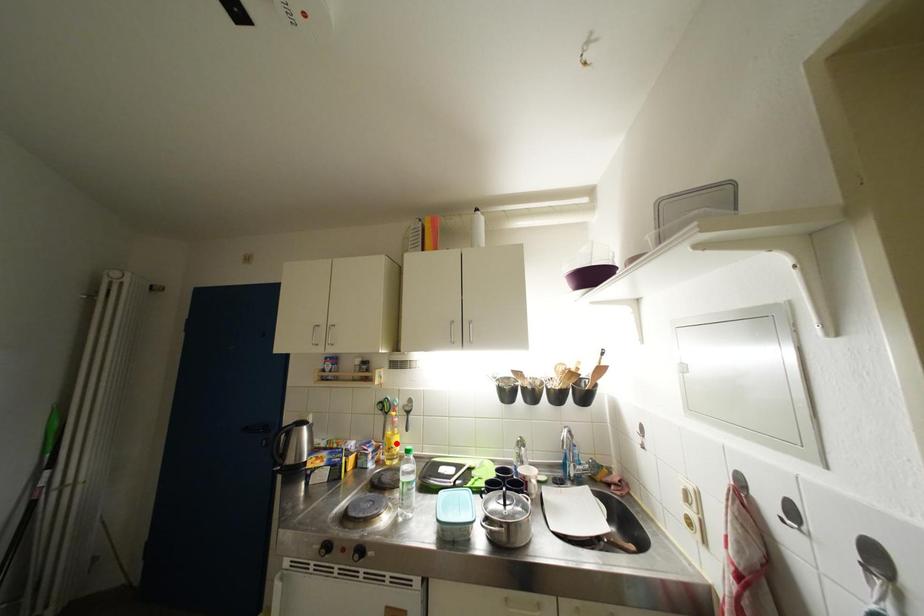
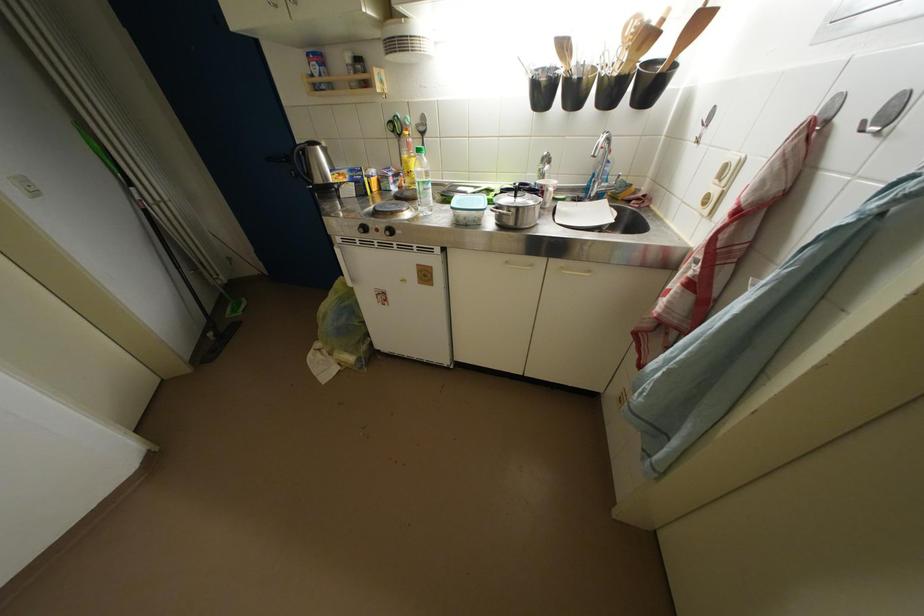
In the second image, find the point that corresponds to the highlighted location in the first image.

(412, 167)